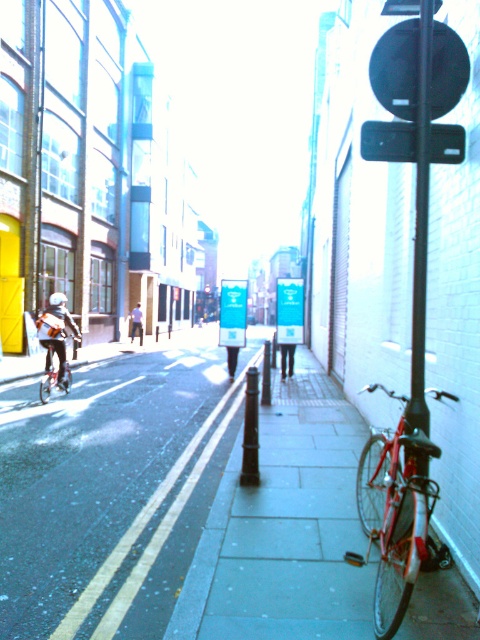
You are a delivery person who needs to place a large package on the ground. The package is too heavy to hold, so you want to put it on the smooth concrete pavement at center or the shiny metallic bicycle at left. Which surface can you safely place the package without it falling over?

The smooth concrete pavement at center is bigger than the shiny metallic bicycle at left, so you can safely place the package on the smooth concrete pavement at center since it has a larger and more stable surface area.

You are a delivery person trying to navigate through the narrow street. You see the black plastic at upper right and the shiny metallic bicycle at left. Which object takes up more horizontal space in the scene?

The black plastic at upper right takes up more horizontal space than the shiny metallic bicycle at left because its width surpasses that of the bicycle.

You are standing on the sidewalk next to the black bollards on the right side of the street. You want to walk to the smooth concrete pavement at center marked by point (285, 528). Is there a clear path between you and that point without crossing the street?

Yes, there is a clear path between you and the smooth concrete pavement at center marked by point (285, 528) because the sidewalk on the right side of the street allows you to walk directly to that point without needing to cross the street.